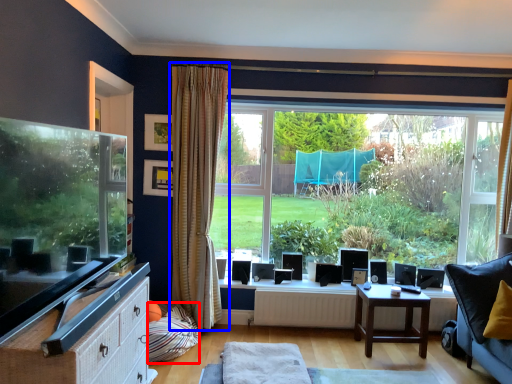
Question: Which object is closer to the camera taking this photo, pillow (highlighted by a red box) or curtain (highlighted by a blue box)?

Choices:
 (A) pillow
 (B) curtain

Answer: (A)